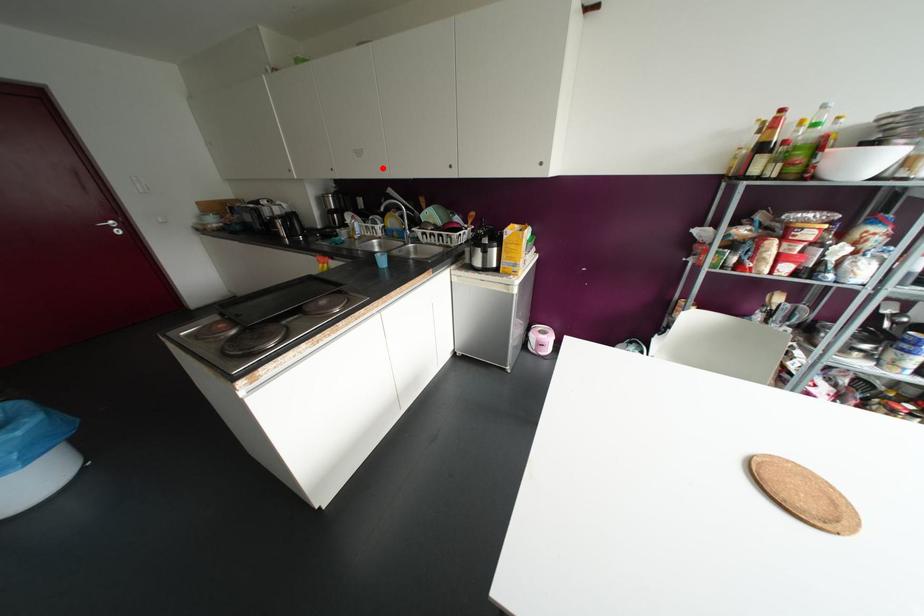
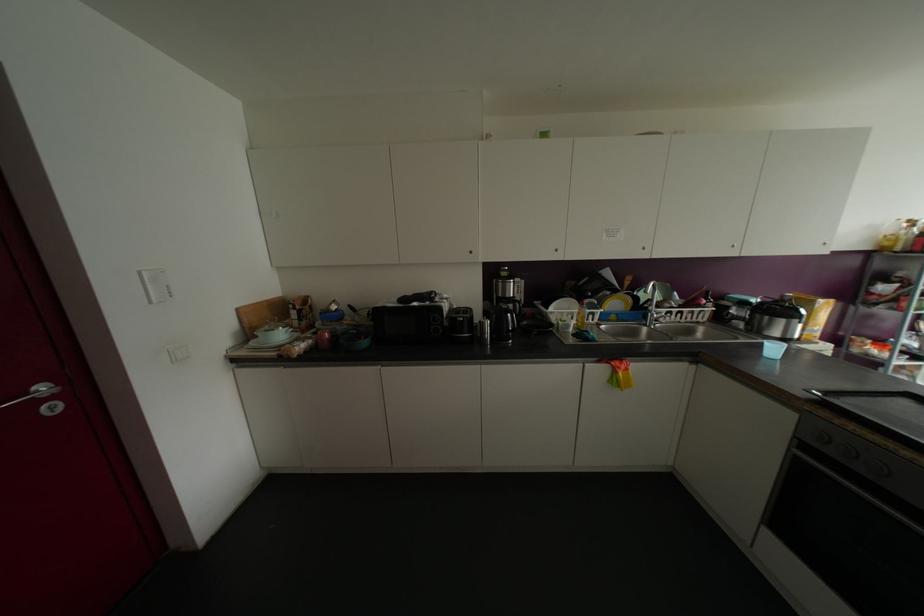
Locate, in the second image, the point that corresponds to the highlighted location in the first image.

(642, 248)